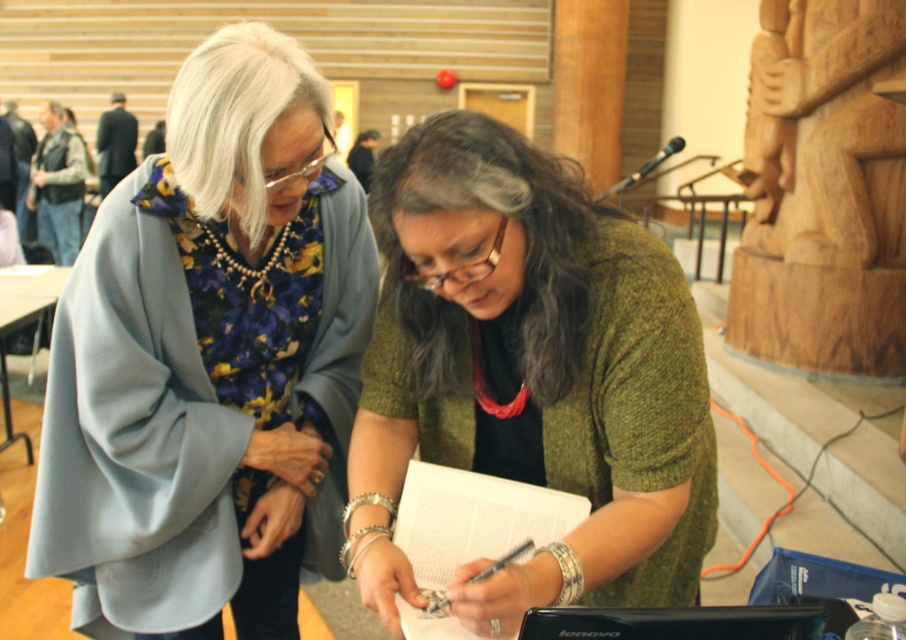
Which is below, green knitted sweater at center or black metallic pen at center?

Positioned lower is black metallic pen at center.

Is the position of green knitted sweater at center more distant than that of black metallic pen at center?

No, green knitted sweater at center is closer to the viewer.

This screenshot has height=640, width=906. Find the location of `green knitted sweater at center`. green knitted sweater at center is located at coordinates (529, 376).

Identify the location of green knitted sweater at center. The width and height of the screenshot is (906, 640). (529, 376).

Is matte blue coat at center shorter than wooden carving at upper right?

Yes, matte blue coat at center is shorter than wooden carving at upper right.

Between point (201, 196) and point (887, 246), which one is positioned behind?

Point (887, 246)

Image resolution: width=906 pixels, height=640 pixels. What are the coordinates of `matte blue coat at center` in the screenshot? It's located at (209, 362).

Can you confirm if matte blue coat at center is smaller than black metallic pen at center?

Actually, matte blue coat at center might be larger than black metallic pen at center.

Can you confirm if matte blue coat at center is taller than black metallic pen at center?

Indeed, matte blue coat at center has a greater height compared to black metallic pen at center.

Which is behind, point (190, 195) or point (512, 557)?

The point (190, 195) is behind.

Where is `matte blue coat at center`? matte blue coat at center is located at coordinates point(209,362).